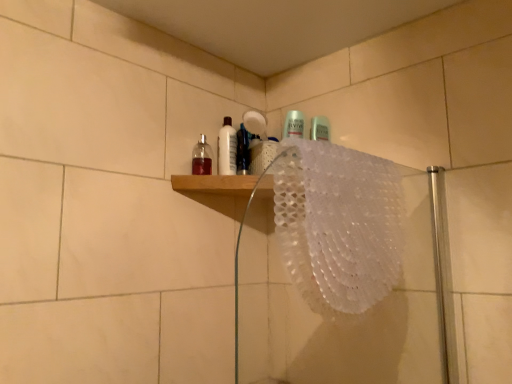
Describe the element at coordinates (338, 224) in the screenshot. This screenshot has height=384, width=512. I see `white textured bath towel at upper right` at that location.

Measure the distance between point (425, 276) and camera.

They are 3.94 feet apart.

Find the location of `translucent glass bottle at upper center, which is the 3th mouthwash from right to left`. translucent glass bottle at upper center, which is the 3th mouthwash from right to left is located at coordinates (202, 157).

Where is `semi-transparent plastic mouthwash at upper center, which is the first mouthwash from right to left`? This screenshot has width=512, height=384. semi-transparent plastic mouthwash at upper center, which is the first mouthwash from right to left is located at coordinates (243, 151).

In the image, is semi-transparent plastic mouthwash at upper center, arranged as the 3th mouthwash when viewed from the left, positioned in front of or behind white textured bath towel at upper right?

semi-transparent plastic mouthwash at upper center, arranged as the 3th mouthwash when viewed from the left, is behind white textured bath towel at upper right.

Is semi-transparent plastic mouthwash at upper center, arranged as the 3th mouthwash when viewed from the left, shorter than white textured bath towel at upper right?

Yes, semi-transparent plastic mouthwash at upper center, arranged as the 3th mouthwash when viewed from the left, is shorter than white textured bath towel at upper right.

Considering the relative sizes of semi-transparent plastic mouthwash at upper center, which is the first mouthwash from right to left, and white textured bath towel at upper right in the image provided, is semi-transparent plastic mouthwash at upper center, which is the first mouthwash from right to left, wider than white textured bath towel at upper right?

In fact, semi-transparent plastic mouthwash at upper center, which is the first mouthwash from right to left, might be narrower than white textured bath towel at upper right.

Is point (243, 132) less distant than point (361, 183)?

No, (243, 132) is behind (361, 183).

Based on their sizes in the image, would you say white glossy bottle at upper center, the 2th mouthwash when ordered from left to right, is bigger or smaller than semi-transparent plastic mouthwash at upper center, which is the first mouthwash from right to left?

Clearly, white glossy bottle at upper center, the 2th mouthwash when ordered from left to right, is smaller in size than semi-transparent plastic mouthwash at upper center, which is the first mouthwash from right to left.

Considering the relative sizes of white glossy bottle at upper center, the 2th mouthwash when ordered from left to right, and semi-transparent plastic mouthwash at upper center, which is the first mouthwash from right to left, in the image provided, is white glossy bottle at upper center, the 2th mouthwash when ordered from left to right, shorter than semi-transparent plastic mouthwash at upper center, which is the first mouthwash from right to left,?

Incorrect, the height of white glossy bottle at upper center, the 2th mouthwash when ordered from left to right, does not fall short of that of semi-transparent plastic mouthwash at upper center, which is the first mouthwash from right to left.

Measure the distance between white glossy bottle at upper center, the 2th mouthwash when ordered from left to right, and semi-transparent plastic mouthwash at upper center, arranged as the 3th mouthwash when viewed from the left.

white glossy bottle at upper center, the 2th mouthwash when ordered from left to right, and semi-transparent plastic mouthwash at upper center, arranged as the 3th mouthwash when viewed from the left, are 1.54 inches apart.

Is white glossy bottle at upper center, the 2th mouthwash positioned from the right, positioned behind semi-transparent plastic mouthwash at upper center, which is the first mouthwash from right to left?

Yes, it is.

Can you confirm if white lace doily at upper center is positioned to the left of translucent glass bottle at upper center, positioned as the first mouthwash in left-to-right order?

No, white lace doily at upper center is not to the left of translucent glass bottle at upper center, positioned as the first mouthwash in left-to-right order.

From a real-world perspective, is white lace doily at upper center positioned above or below translucent glass bottle at upper center, which is the 3th mouthwash from right to left?

white lace doily at upper center is situated lower than translucent glass bottle at upper center, which is the 3th mouthwash from right to left, in the real world.

Considering the positions of objects white lace doily at upper center and translucent glass bottle at upper center, positioned as the first mouthwash in left-to-right order, in the image provided, who is in front, white lace doily at upper center or translucent glass bottle at upper center, positioned as the first mouthwash in left-to-right order,?

white lace doily at upper center is closer to the camera.

Looking at the image, does white lace doily at upper center seem bigger or smaller compared to translucent glass bottle at upper center, which is the 3th mouthwash from right to left?

Clearly, white lace doily at upper center is larger in size than translucent glass bottle at upper center, which is the 3th mouthwash from right to left.

In order to click on the 1st mouthwash above the translucent glass bottle at upper center, positioned as the first mouthwash in left-to-right order (from a real-world perspective) in this screenshot , I will do `click(243, 151)`.

From the image's perspective, which one is positioned higher, semi-transparent plastic mouthwash at upper center, arranged as the 3th mouthwash when viewed from the left, or translucent glass bottle at upper center, which is the 3th mouthwash from right to left?

From the image's view, semi-transparent plastic mouthwash at upper center, arranged as the 3th mouthwash when viewed from the left, is above.

Considering the sizes of objects semi-transparent plastic mouthwash at upper center, arranged as the 3th mouthwash when viewed from the left, and translucent glass bottle at upper center, positioned as the first mouthwash in left-to-right order, in the image provided, who is thinner, semi-transparent plastic mouthwash at upper center, arranged as the 3th mouthwash when viewed from the left, or translucent glass bottle at upper center, positioned as the first mouthwash in left-to-right order,?

A: With smaller width is translucent glass bottle at upper center, positioned as the first mouthwash in left-to-right order.

Does point (243, 152) come in front of point (199, 173)?

That is False.

From a real-world perspective, between white textured bath towel at upper right and white glossy bottle at upper center, the 2th mouthwash positioned from the right, who is vertically higher?

white glossy bottle at upper center, the 2th mouthwash positioned from the right, is physically above.

Can you tell me how much white textured bath towel at upper right and white glossy bottle at upper center, the 2th mouthwash positioned from the right, differ in facing direction?

25.5 degrees.

This screenshot has width=512, height=384. I want to click on bath towel lying in front of the white glossy bottle at upper center, the 2th mouthwash positioned from the right, so click(338, 224).

Is white textured bath towel at upper right positioned far away from white glossy bottle at upper center, the 2th mouthwash positioned from the right?

No, white textured bath towel at upper right is in close proximity to white glossy bottle at upper center, the 2th mouthwash positioned from the right.

From a real-world perspective, count 2nd mouthwashs downward from the white glossy bottle at upper center, the 2th mouthwash when ordered from left to right, and point to it. Please provide its 2D coordinates.

[(202, 157)]

Which is less distant, (199,159) or (225,160)?

Point (199,159) is positioned closer to the camera compared to point (225,160).

Does point (226, 161) appear closer or farther from the camera than point (196, 156)?

Point (226, 161) is farther from the camera than point (196, 156).

In terms of size, does white glossy bottle at upper center, the 2th mouthwash positioned from the right, appear bigger or smaller than translucent glass bottle at upper center, which is the 3th mouthwash from right to left?

In the image, white glossy bottle at upper center, the 2th mouthwash positioned from the right, appears to be smaller than translucent glass bottle at upper center, which is the 3th mouthwash from right to left.

Considering the sizes of objects white glossy bottle at upper center, the 2th mouthwash when ordered from left to right, and translucent glass bottle at upper center, positioned as the first mouthwash in left-to-right order, in the image provided, who is thinner, white glossy bottle at upper center, the 2th mouthwash when ordered from left to right, or translucent glass bottle at upper center, positioned as the first mouthwash in left-to-right order,?

Thinner between the two is white glossy bottle at upper center, the 2th mouthwash when ordered from left to right.

Find the location of a particular element. bath towel in front of the semi-transparent plastic mouthwash at upper center, which is the first mouthwash from right to left is located at coordinates (338, 224).

Where is `mouthwash that is the 1st object to the left of the semi-transparent plastic mouthwash at upper center, arranged as the 3th mouthwash when viewed from the left, starting at the anchor`? Image resolution: width=512 pixels, height=384 pixels. mouthwash that is the 1st object to the left of the semi-transparent plastic mouthwash at upper center, arranged as the 3th mouthwash when viewed from the left, starting at the anchor is located at coordinates (227, 148).

Considering their positions, is white textured bath towel at upper right positioned closer to semi-transparent plastic mouthwash at upper center, which is the first mouthwash from right to left, than translucent glass bottle at upper center, positioned as the first mouthwash in left-to-right order?

Among the two, translucent glass bottle at upper center, positioned as the first mouthwash in left-to-right order, is located nearer to semi-transparent plastic mouthwash at upper center, which is the first mouthwash from right to left.

Which object lies nearer to the anchor point white lace doily at upper center, white textured bath towel at upper right or translucent glass bottle at upper center, which is the 3th mouthwash from right to left?

white textured bath towel at upper right is positioned closer to the anchor white lace doily at upper center.

Based on the photo, estimate the real-world distances between objects in this image. Which object is closer to white lace doily at upper center, white textured bath towel at upper right or white glossy bottle at upper center, the 2th mouthwash positioned from the right?

Based on the image, white textured bath towel at upper right appears to be nearer to white lace doily at upper center.

Estimate the real-world distances between objects in this image. Which object is closer to white glossy bottle at upper center, the 2th mouthwash positioned from the right, translucent glass bottle at upper center, positioned as the first mouthwash in left-to-right order, or white lace doily at upper center?

translucent glass bottle at upper center, positioned as the first mouthwash in left-to-right order.

Which object lies nearer to the anchor point white lace doily at upper center, white glossy bottle at upper center, the 2th mouthwash positioned from the right, or semi-transparent plastic mouthwash at upper center, which is the first mouthwash from right to left?

white glossy bottle at upper center, the 2th mouthwash positioned from the right, is positioned closer to the anchor white lace doily at upper center.

From the image, which object appears to be nearer to white textured bath towel at upper right, translucent glass bottle at upper center, which is the 3th mouthwash from right to left, or white lace doily at upper center?

Among the two, white lace doily at upper center is located nearer to white textured bath towel at upper right.

Estimate the real-world distances between objects in this image. Which object is closer to translucent glass bottle at upper center, which is the 3th mouthwash from right to left, white textured bath towel at upper right or white glossy bottle at upper center, the 2th mouthwash positioned from the right?

white glossy bottle at upper center, the 2th mouthwash positioned from the right, is closer to translucent glass bottle at upper center, which is the 3th mouthwash from right to left.

Based on their spatial positions, is semi-transparent plastic mouthwash at upper center, arranged as the 3th mouthwash when viewed from the left, or white textured bath towel at upper right further from translucent glass bottle at upper center, which is the 3th mouthwash from right to left?

white textured bath towel at upper right is positioned further to the anchor translucent glass bottle at upper center, which is the 3th mouthwash from right to left.

The width and height of the screenshot is (512, 384). In order to click on mouthwash situated between translucent glass bottle at upper center, which is the 3th mouthwash from right to left, and semi-transparent plastic mouthwash at upper center, which is the first mouthwash from right to left, from left to right in this screenshot , I will do point(227,148).

Locate an element on the screen. This screenshot has width=512, height=384. bath towel located between white lace doily at upper center and translucent glass bottle at upper center, which is the 3th mouthwash from right to left, in the depth direction is located at coordinates (338, 224).

Image resolution: width=512 pixels, height=384 pixels. Find the location of `bath towel between white lace doily at upper center and white glossy bottle at upper center, the 2th mouthwash positioned from the right, from front to back`. bath towel between white lace doily at upper center and white glossy bottle at upper center, the 2th mouthwash positioned from the right, from front to back is located at coordinates (338, 224).

What are the coordinates of `mouthwash positioned between white lace doily at upper center and semi-transparent plastic mouthwash at upper center, arranged as the 3th mouthwash when viewed from the left, from near to far` in the screenshot? It's located at (202, 157).